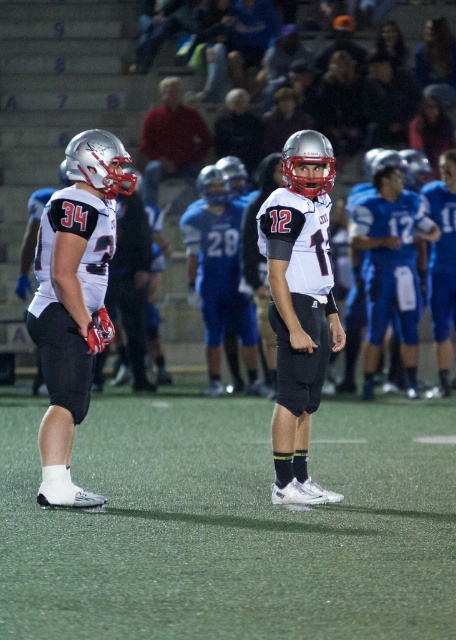
You are a photographer standing at the center of the field during the nighttime football game. You want to take a photo that includes both the point at coordinates point (286, 141) and point (249, 131). However, you need to ensure that the point closer to the camera is in focus first. Which point should you focus on first?

Point (286, 141) is closer to the camera than point (249, 131), so you should focus on point (286, 141) first to ensure it is in focus before adjusting for the other point.

You are a sports analyst reviewing the game footage. You notice two jerseys in the image, the white matte jersey at left and the blue fabric jersey at right. Which jersey appears narrower in the image?

The white matte jersey at left appears narrower compared to the blue fabric jersey at right as per the description provided.